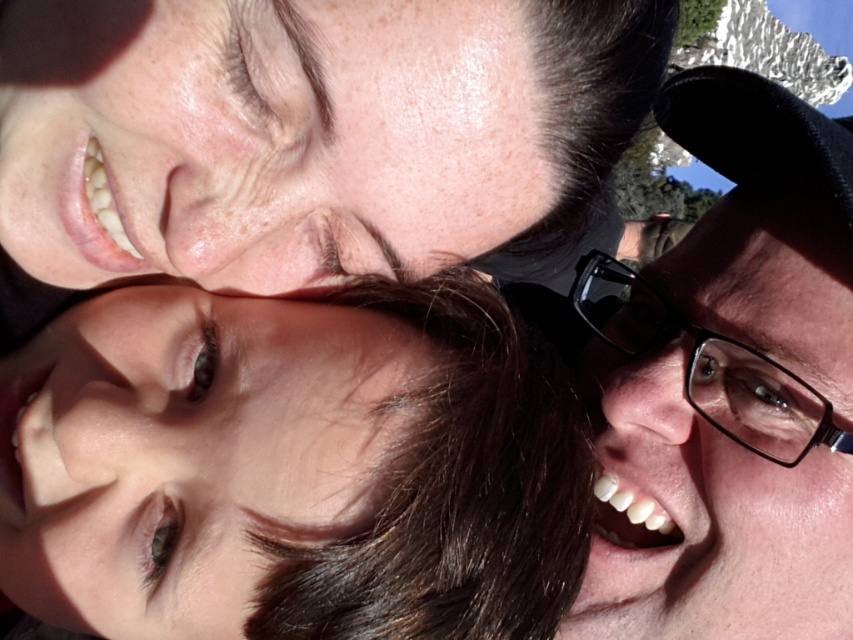
You are a photographer adjusting your camera settings to focus on the black plastic glasses at right and the black plastic glasses at upper right. Which pair of glasses should you focus on first to ensure they are sharp in the photo?

You should focus on the black plastic glasses at right first because it is closer to the viewer than the black plastic glasses at upper right, so focusing on the closer object ensures sharpness when using depth of field.

You are taking a photo of two points in the scene. The first point is labeled as point (x=375, y=369) and the second is point (x=569, y=300). Which point is closer to the camera?

Point (x=375, y=369) is in front of point (x=569, y=300), so it is closer to the camera.